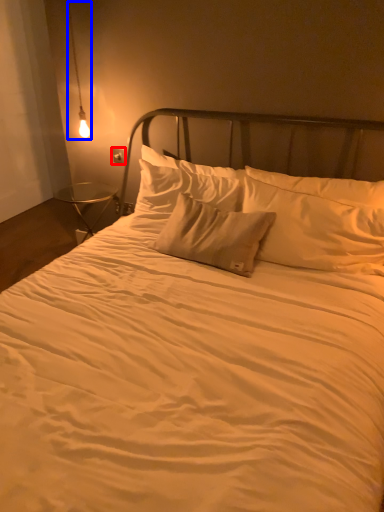
Question: Which object appears closest to the camera in this image, electric outlet (highlighted by a red box) or lamp (highlighted by a blue box)?

Choices:
 (A) electric outlet
 (B) lamp

Answer: (B)